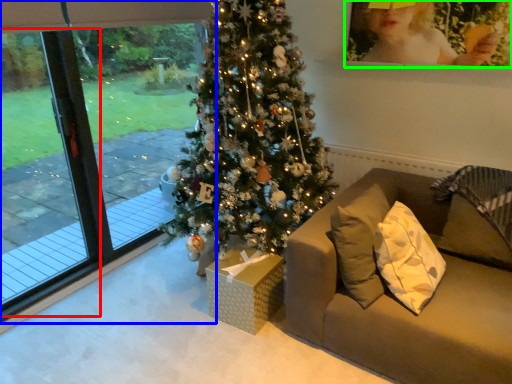
Question: Considering the real-world distances, which object is farthest from screen door (highlighted by a red box)? window (highlighted by a blue box) or picture frame (highlighted by a green box)?

Choices:
 (A) window
 (B) picture frame

Answer: (B)